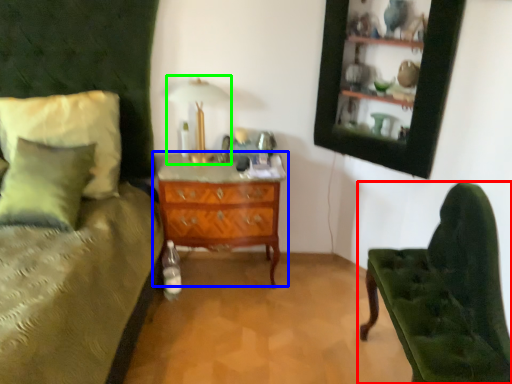
Question: Considering the real-world distances, which object is farthest from chair (highlighted by a red box)? chest of drawers (highlighted by a blue box) or table lamp (highlighted by a green box)?

Choices:
 (A) chest of drawers
 (B) table lamp

Answer: (B)